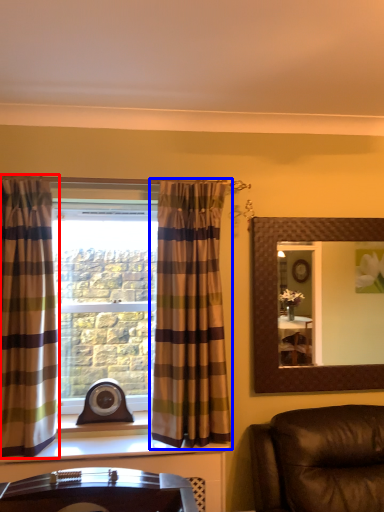
Question: Which object is closer to the camera taking this photo, curtain (highlighted by a red box) or curtain (highlighted by a blue box)?

Choices:
 (A) curtain
 (B) curtain

Answer: (A)